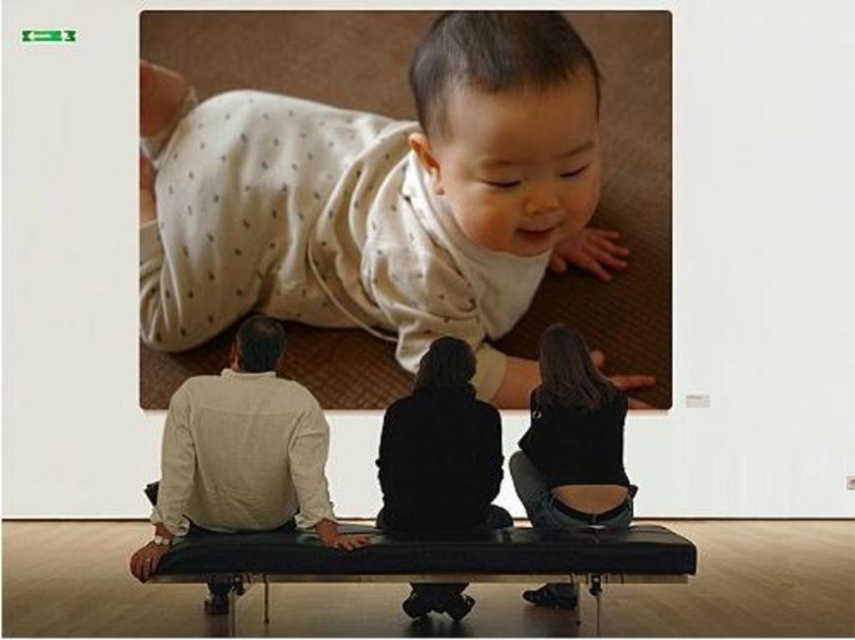
You are standing in the art gallery and want to sit down on either the black leather bench at center or the denim jeans at lower right. Which one is closer to you?

The black leather bench at center is closer to the viewer than the denim jeans at lower right, so you should choose the black leather bench at center.

Consider the image. You are a tour guide standing at the entrance of the art gallery. You want to point out the light beige dotted fabric at upper center to your visitors. Can you reach it with a 5 meter long pointer?

The light beige dotted fabric at upper center is 5.32 meters away from the camera. Since the pointer is only 5 meters long, it cannot reach the fabric.

You are an interior designer planning to add a new artwork to this gallery. The current artwork displayed is the light beige dotted fabric at upper center. You want to place a new sculpture on the black leather bench at center. Considering the size of the existing artwork and the bench, will the sculpture fit on the bench?

The light beige dotted fabric at upper center is bigger than the black leather bench at center, so the sculpture may not fit on the black leather bench at center if it is as large as the artwork.